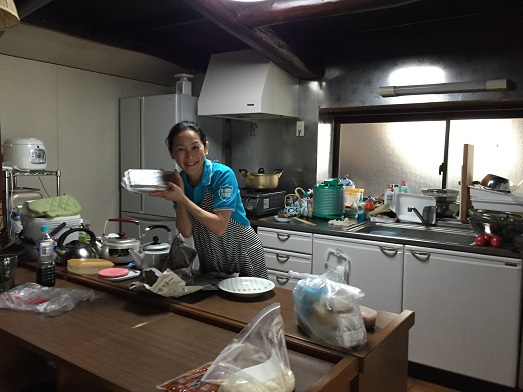
Image resolution: width=523 pixels, height=392 pixels. Identify the location of kitchen scale. (179, 85).